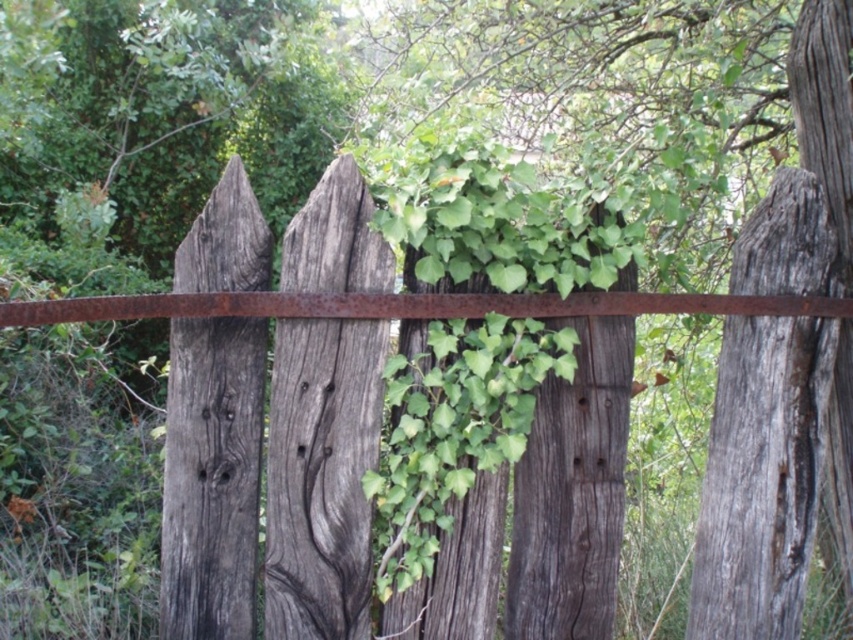
This screenshot has width=853, height=640. What do you see at coordinates (321, 476) in the screenshot? I see `gray weathered wood at center` at bounding box center [321, 476].

Does gray weathered wood at center appear on the right side of weathered gray wood at left?

Correct, you'll find gray weathered wood at center to the right of weathered gray wood at left.

Is point (292, 506) positioned before point (241, 433)?

No.

At what (x,y) coordinates should I click in order to perform the action: click on gray weathered wood at center. Please return your answer as a coordinate pair (x, y). Image resolution: width=853 pixels, height=640 pixels. Looking at the image, I should click on (321, 476).